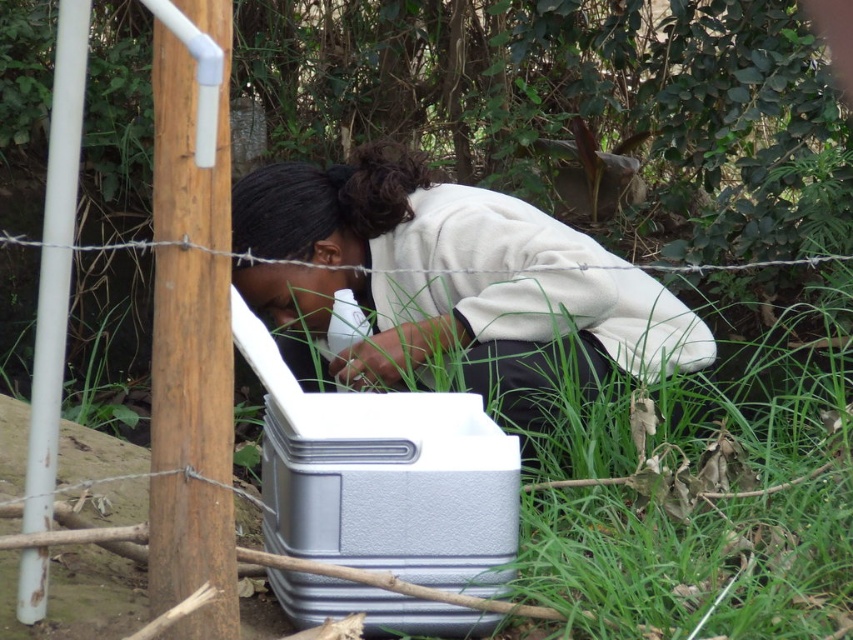
You are a delivery person who needs to place a new cooler next to the existing one. The new cooler is the same size as the white matte pole at left. Can you fit it next to the silver textured cooler at center without moving the existing cooler?

The silver textured cooler at center is larger in size than the white matte pole at left. Since the new cooler is the same size as the white matte pole at left, there should be enough space to fit it next to the silver textured cooler at center without moving it.

You are a photographer trying to capture a clear shot of the white matte cooler at center and the brown wood pole at left. Since the fence is in the way, you need to adjust your position. Which object should you move closer to the camera to ensure it stays in focus while the other might get slightly out of frame?

The white matte cooler at center is closer to the viewer than the brown wood pole at left. To keep the white matte cooler at center in focus and possibly let the brown wood pole at left go out of frame, you should position yourself so the cooler remains centered and closer to the camera lens.